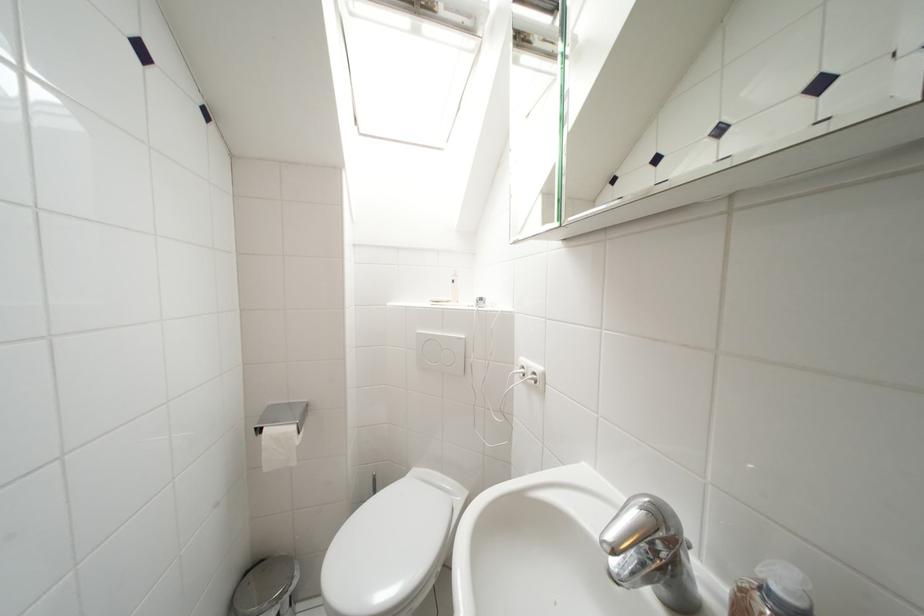
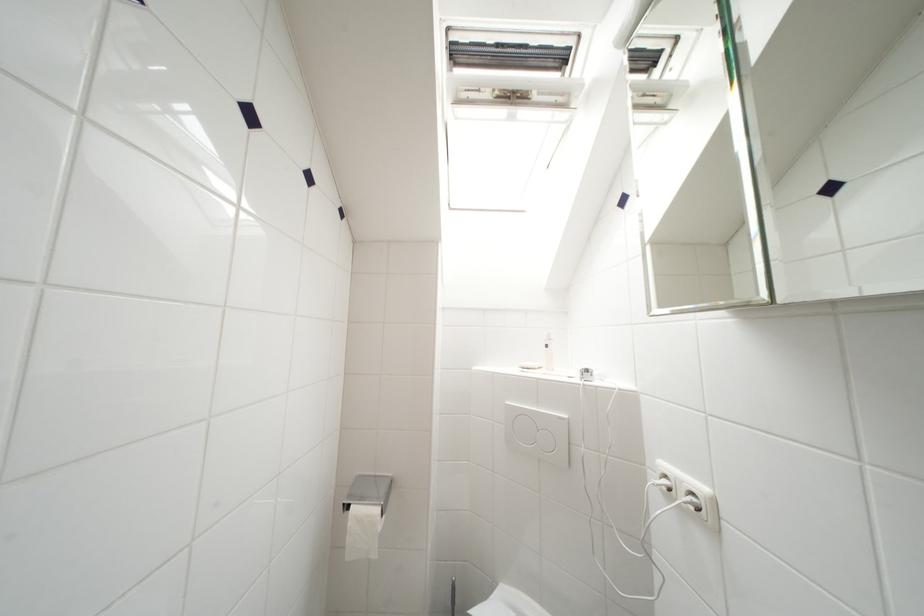
The point at (529,371) is marked in the first image. Where is the corresponding point in the second image?

(672, 480)